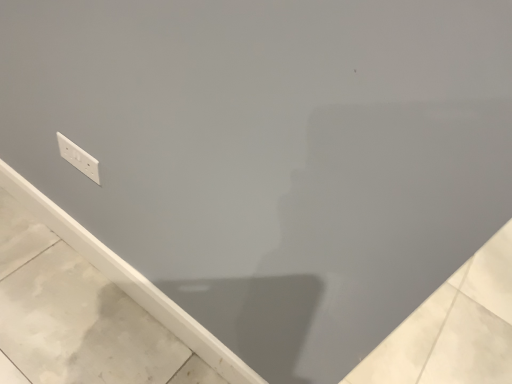
The width and height of the screenshot is (512, 384). I want to click on white plastic power plugs and sockets at upper left, so click(78, 158).

In order to face white plastic power plugs and sockets at upper left, should I rotate leftwards or rightwards?

It's best to rotate left around 21.962 degrees.

This screenshot has height=384, width=512. Describe the element at coordinates (78, 158) in the screenshot. I see `white plastic power plugs and sockets at upper left` at that location.

Find the location of `white plastic power plugs and sockets at upper left`. white plastic power plugs and sockets at upper left is located at coordinates (78, 158).